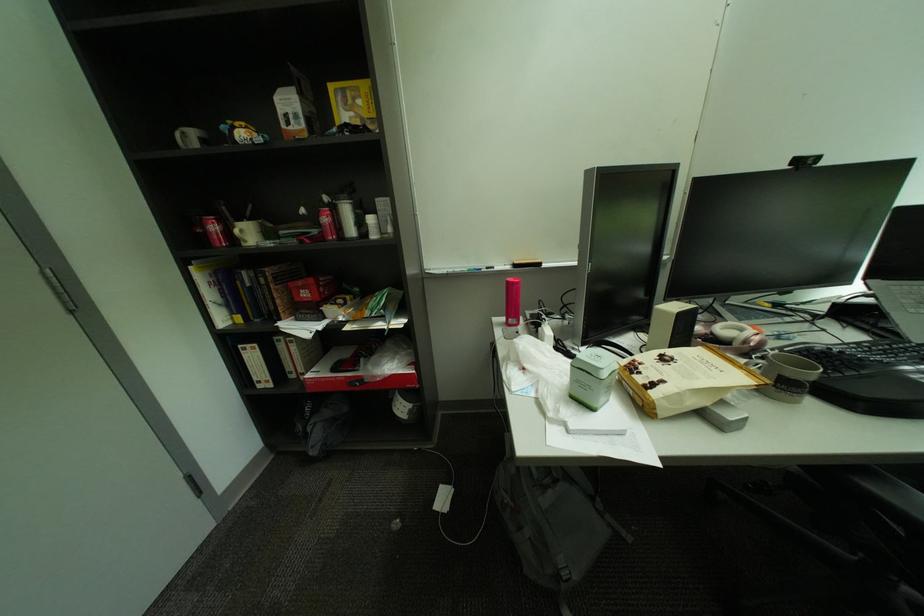
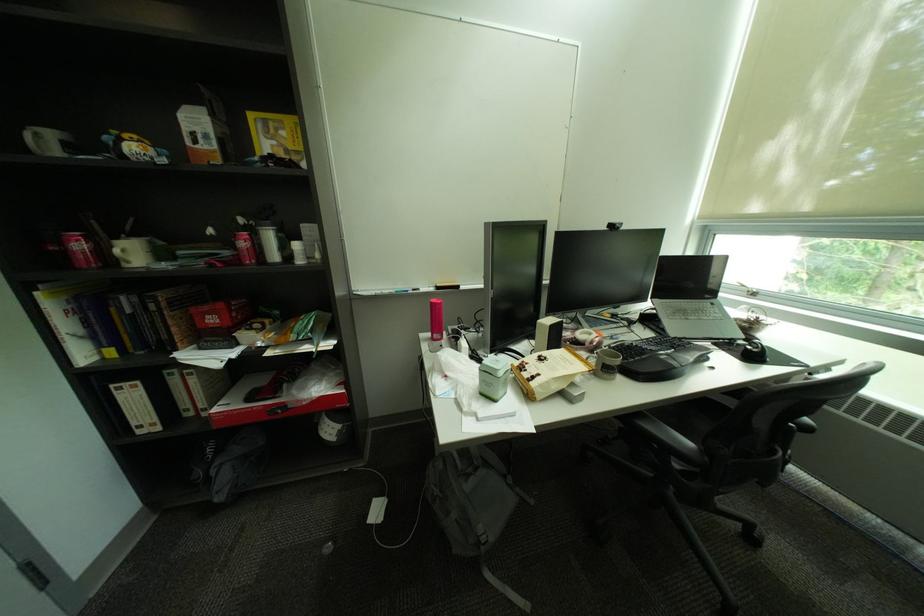
Where in the second image is the point corresponding to [248,233] from the first image?

(128, 252)